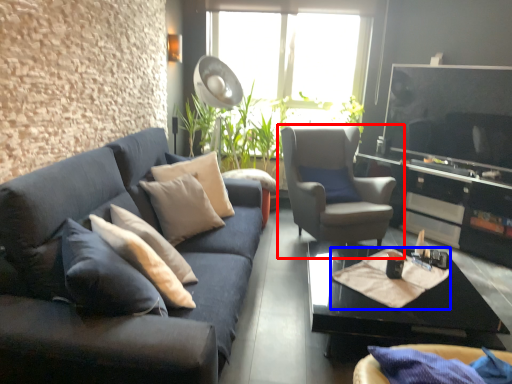
Question: Which object appears farthest to the camera in this image, chair (highlighted by a red box) or material (highlighted by a blue box)?

Choices:
 (A) chair
 (B) material

Answer: (A)